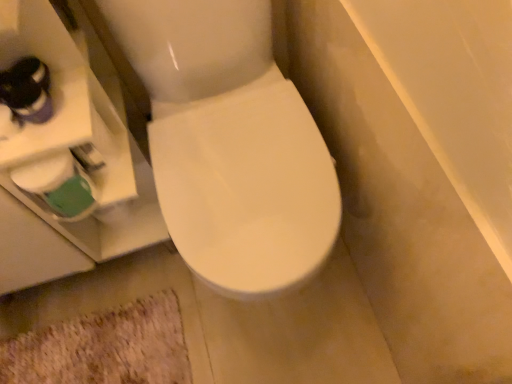
Image resolution: width=512 pixels, height=384 pixels. I want to click on unoccupied region to the right of beige shaggy bath mat at lower left, so click(240, 327).